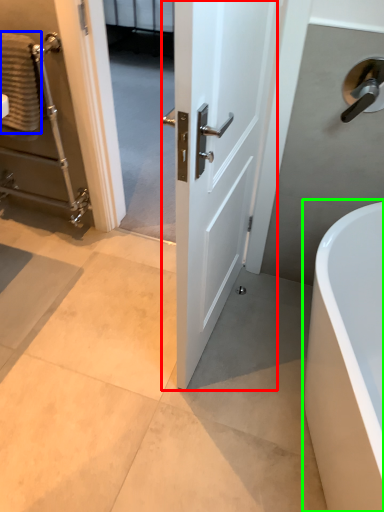
Question: Which object is the farthest from door (highlighted by a red box)? Choose among these: material (highlighted by a blue box) or bathtub (highlighted by a green box).

Choices:
 (A) material
 (B) bathtub

Answer: (A)